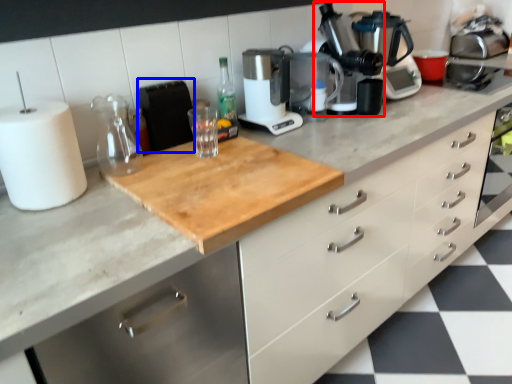
Question: Which object is closer to the camera taking this photo, coffee machine (highlighted by a red box) or appliance (highlighted by a blue box)?

Choices:
 (A) coffee machine
 (B) appliance

Answer: (B)